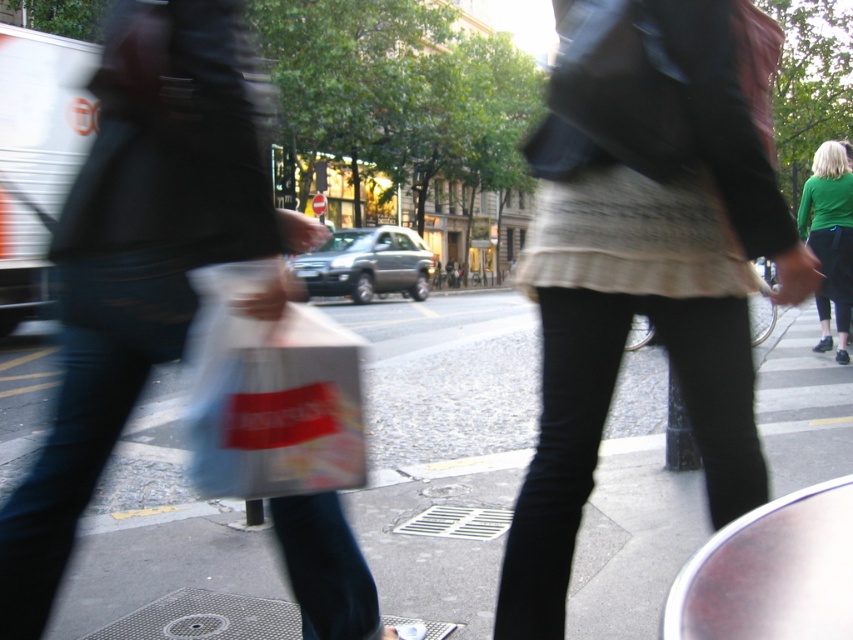
Question: Which object is the farthest from the green fabric jacket at upper right?

Choices:
 (A) smooth asphalt at center
 (B) knit sweater at center

Answer: (B)

Question: Does knit sweater at center have a larger size compared to green fabric jacket at upper right?

Choices:
 (A) no
 (B) yes

Answer: (B)

Question: Which of the following is the farthest from the observer?

Choices:
 (A) (132, 352)
 (B) (822, 307)
 (C) (444, 369)
 (D) (343, 337)

Answer: (C)

Question: Is smooth asphalt at center positioned at the back of knit sweater at center?

Choices:
 (A) no
 (B) yes

Answer: (B)

Question: Which of the following is the closest to the observer?

Choices:
 (A) matte plastic bag at center
 (B) smooth asphalt at center
 (C) green fabric jacket at upper right
 (D) translucent plastic bag at center

Answer: (A)

Question: Does translucent plastic bag at center have a larger size compared to green fabric jacket at upper right?

Choices:
 (A) no
 (B) yes

Answer: (A)